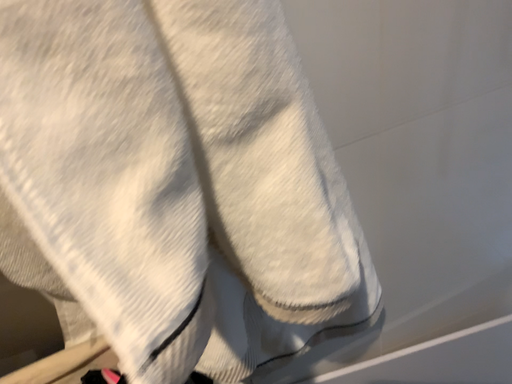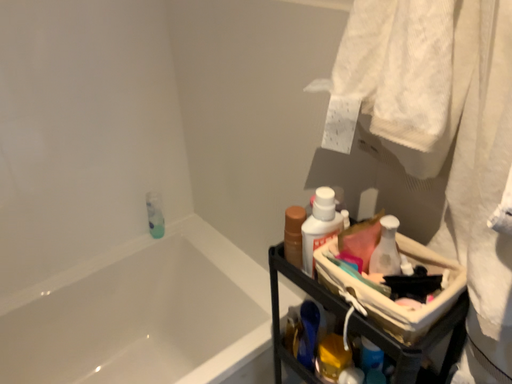
Question: Which way did the camera rotate in the video?

Choices:
 (A) rotated left
 (B) rotated right

Answer: (A)